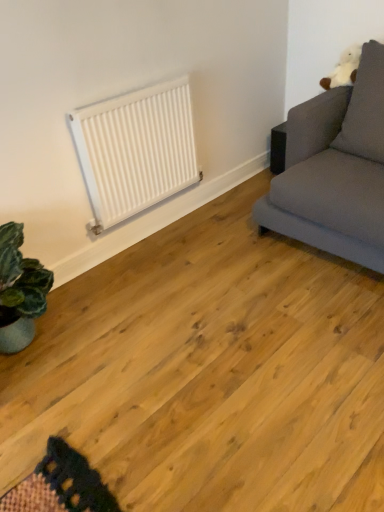
Image resolution: width=384 pixels, height=512 pixels. What are the coordinates of `white plush pillow at upper right` in the screenshot? It's located at (365, 108).

What is the approximate width of gray fabric couch at upper right?

1.05 meters.

The height and width of the screenshot is (512, 384). Describe the element at coordinates (136, 150) in the screenshot. I see `white matte radiator at upper center` at that location.

The height and width of the screenshot is (512, 384). I want to click on white plush pillow at upper right, so click(365, 108).

How different are the orientations of gray fabric couch at upper right and white plush pillow at upper right in degrees?

0.402 degrees separate the facing orientations of gray fabric couch at upper right and white plush pillow at upper right.

Is gray fabric couch at upper right aimed at white plush pillow at upper right?

Yes, gray fabric couch at upper right is aimed at white plush pillow at upper right.

From the image's perspective, relative to white plush pillow at upper right, is gray fabric couch at upper right above or below?

Based on their image positions, gray fabric couch at upper right is located beneath white plush pillow at upper right.

Measure the distance between gray fabric couch at upper right and white plush pillow at upper right.

gray fabric couch at upper right and white plush pillow at upper right are 6.46 inches apart.

From the image's perspective, relative to white matte radiator at upper center, is gray fabric couch at upper right above or below?

Answer: gray fabric couch at upper right is above white matte radiator at upper center.

Would you say gray fabric couch at upper right is to the left or to the right of white matte radiator at upper center in the picture?

Based on their positions, gray fabric couch at upper right is located to the right of white matte radiator at upper center.

Is gray fabric couch at upper right shorter than white matte radiator at upper center?

No.

From the image's perspective, is white plush pillow at upper right above or below gray fabric couch at upper right?

From the image's perspective, white plush pillow at upper right appears above gray fabric couch at upper right.

Considering the relative positions of white plush pillow at upper right and gray fabric couch at upper right in the image provided, is white plush pillow at upper right in front of gray fabric couch at upper right?

No, white plush pillow at upper right is behind gray fabric couch at upper right.

Consider the image. Does white plush pillow at upper right appear on the left side of gray fabric couch at upper right?

Yes, white plush pillow at upper right is to the left of gray fabric couch at upper right.

Locate an element on the screen. This screenshot has height=512, width=384. pillow behind the gray fabric couch at upper right is located at coordinates (365, 108).

Which of these two, white matte radiator at upper center or white plush pillow at upper right, is smaller?

With smaller size is white matte radiator at upper center.

From a real-world perspective, relative to white plush pillow at upper right, is white matte radiator at upper center vertically above or below?

From a real-world perspective, white matte radiator at upper center is physically below white plush pillow at upper right.

Is white matte radiator at upper center with white plush pillow at upper right?

No, white matte radiator at upper center is not with white plush pillow at upper right.

Between white matte radiator at upper center and white plush pillow at upper right, which one has more height?

With more height is white plush pillow at upper right.

Are white matte radiator at upper center and gray fabric couch at upper right located far from each other?

white matte radiator at upper center is actually quite close to gray fabric couch at upper right.

Considering the sizes of objects white matte radiator at upper center and gray fabric couch at upper right in the image provided, who is taller, white matte radiator at upper center or gray fabric couch at upper right?

Standing taller between the two is gray fabric couch at upper right.

Can you confirm if white matte radiator at upper center is smaller than gray fabric couch at upper right?

Indeed, white matte radiator at upper center has a smaller size compared to gray fabric couch at upper right.

Considering the relative positions of white matte radiator at upper center and gray fabric couch at upper right in the image provided, is white matte radiator at upper center to the left or to the right of gray fabric couch at upper right?

white matte radiator at upper center is positioned on gray fabric couch at upper right's left side.

Is white plush pillow at upper right located outside white matte radiator at upper center?

That's correct, white plush pillow at upper right is outside of white matte radiator at upper center.

In terms of height, does white plush pillow at upper right look taller or shorter compared to white matte radiator at upper center?

Considering their sizes, white plush pillow at upper right has more height than white matte radiator at upper center.

How many degrees apart are the facing directions of white plush pillow at upper right and white matte radiator at upper center?

The facing directions of white plush pillow at upper right and white matte radiator at upper center are 90.9 degrees apart.

Is white plush pillow at upper right not near white matte radiator at upper center?

No, white plush pillow at upper right is not far from white matte radiator at upper center.

The image size is (384, 512). I want to click on pillow that is behind the gray fabric couch at upper right, so click(365, 108).

This screenshot has height=512, width=384. Identify the location of radiator located on the left of gray fabric couch at upper right. (136, 150).

Looking at the image, which one is located closer to white matte radiator at upper center, white plush pillow at upper right or gray fabric couch at upper right?

The object closer to white matte radiator at upper center is gray fabric couch at upper right.

Considering their positions, is white plush pillow at upper right positioned closer to gray fabric couch at upper right than white matte radiator at upper center?

white plush pillow at upper right lies closer to gray fabric couch at upper right than the other object.

Considering their positions, is white matte radiator at upper center positioned further to white plush pillow at upper right than gray fabric couch at upper right?

white matte radiator at upper center.

Based on their spatial positions, is gray fabric couch at upper right or white plush pillow at upper right further from white matte radiator at upper center?

white plush pillow at upper right lies further to white matte radiator at upper center than the other object.

From the image, which object appears to be farther from gray fabric couch at upper right, white matte radiator at upper center or white plush pillow at upper right?

white matte radiator at upper center lies further to gray fabric couch at upper right than the other object.

Considering their positions, is gray fabric couch at upper right positioned closer to white plush pillow at upper right than white matte radiator at upper center?

gray fabric couch at upper right is closer to white plush pillow at upper right.

You are a GUI agent. You are given a task and a screenshot of the screen. Output one action in this format:
    pyautogui.click(x=<x>, y=<y>)
    Task: Click on the pillow between white matte radiator at upper center and gray fabric couch at upper right in the horizontal direction
    
    Given the screenshot: What is the action you would take?
    pyautogui.click(x=365, y=108)